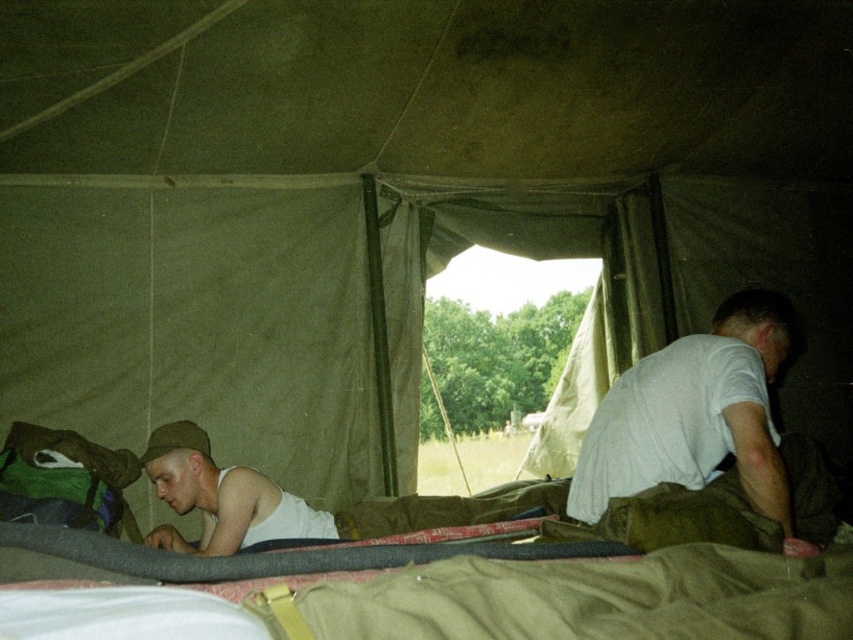
You are inside the tent and need to reach the white cotton shirt at right without stepping on the khaki fabric at lower center. Which direction should you move?

Move to the right side of the tent to avoid the khaki fabric at lower center and reach the white cotton shirt at right.